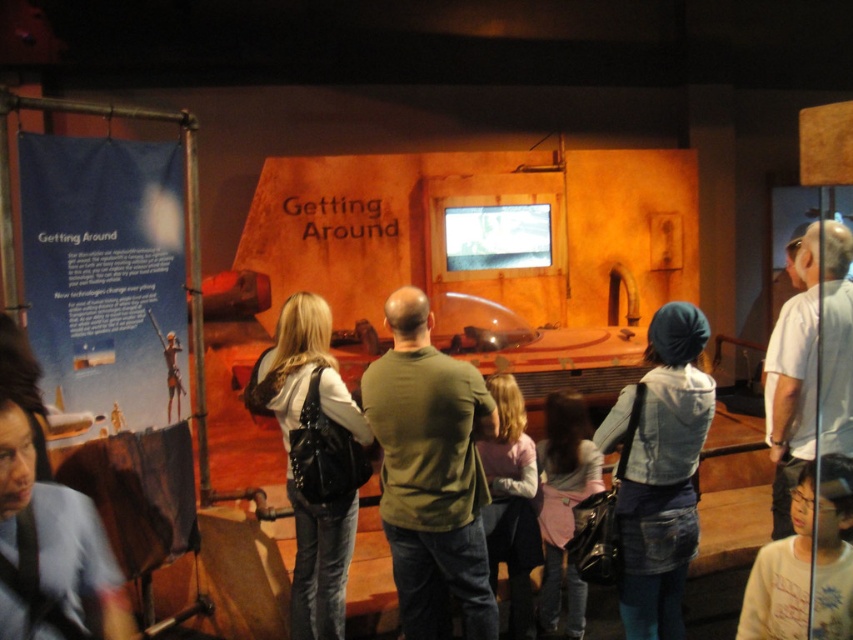
Question: Which of the following is the farthest from the observer?

Choices:
 (A) (39, 556)
 (B) (531, 598)
 (C) (811, 289)
 (D) (759, 625)

Answer: (B)

Question: Which object is closer to the camera taking this photo?

Choices:
 (A) pink fabric at center
 (B) white leather jacket at center
 (C) green matte shirt at center
 (D) blue shirt at lower left

Answer: (D)

Question: Does white leather jacket at center lie behind pink fabric at center?

Choices:
 (A) no
 (B) yes

Answer: (A)

Question: Does white leather jacket at center have a larger size compared to white cotton shirt at lower right?

Choices:
 (A) yes
 (B) no

Answer: (A)

Question: In this image, where is white leather jacket at center located relative to blue shirt at lower left?

Choices:
 (A) left
 (B) right

Answer: (B)

Question: Among these points, which one is farthest from the camera?

Choices:
 (A) (287, 490)
 (B) (526, 564)

Answer: (B)